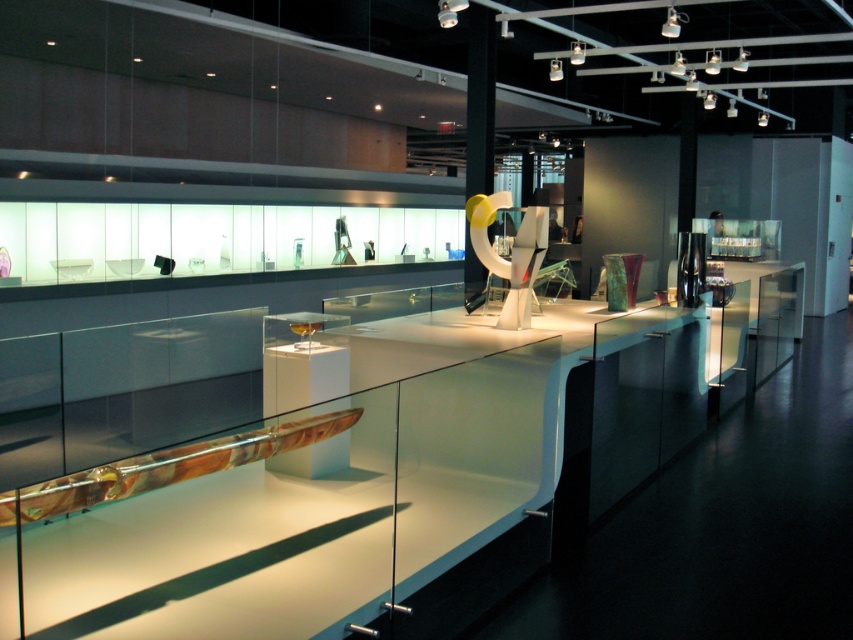
Is point (410, 612) positioned in front of point (503, 272)?

Yes, it is in front of point (503, 272).

Does white glossy counter top at center have a greater height compared to translucent glass sculpture at center?

Indeed, white glossy counter top at center has a greater height compared to translucent glass sculpture at center.

Is point (480, 321) closer to camera compared to point (532, 243)?

No, it is behind (532, 243).

Where is `white glossy counter top at center`? This screenshot has height=640, width=853. white glossy counter top at center is located at coordinates (363, 467).